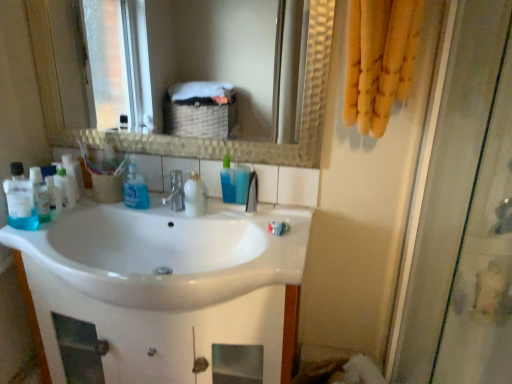
Question: From a real-world perspective, is satin nickel faucet at center, arranged as the 2th tap when viewed from the right, positioned above or below white glossy bottle at center, which is the 3th cleaning product in left-to-right order?

Choices:
 (A) above
 (B) below

Answer: (B)

Question: Looking at the image, does satin nickel faucet at center, arranged as the 2th tap when viewed from the right, seem bigger or smaller compared to white glossy bottle at center, which is the 3th cleaning product in left-to-right order?

Choices:
 (A) big
 (B) small

Answer: (B)

Question: Based on their relative distances, which object is nearer to the white glossy toothpaste at center?

Choices:
 (A) blue translucent bottle at center, which appears as the fourth cleaning product when viewed from the left
 (B) translucent plastic bottles at left, which ranks as the fourth cleaning product in right-to-left order
 (C) white glossy bottle at center, which is the 3th cleaning product in left-to-right order
 (D) satin nickel faucet at center, which ranks as the first tap in left-to-right order
 (E) satin nickel faucet at center, placed as the 1th tap when sorted from right to left

Answer: (E)

Question: Considering the real-world distances, which object is closest to the blue liquid soap at center, acting as the 2th cleaning product starting from the left?

Choices:
 (A) transparent glass shower door at right
 (B) white glossy toothpaste at center
 (C) white glossy bottle at center, which is the 3th cleaning product in left-to-right order
 (D) translucent plastic bottles at left, which ranks as the fourth cleaning product in right-to-left order
 (E) blue translucent bottle at center, arranged as the 1th cleaning product when viewed from the right

Answer: (C)